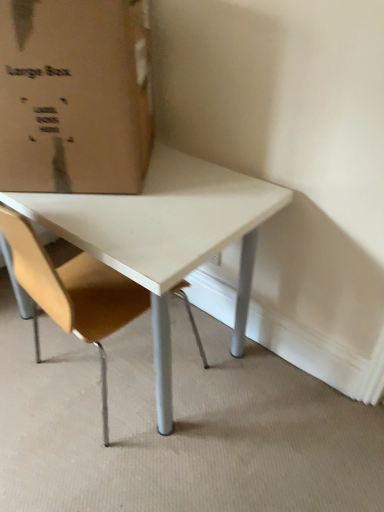
Locate an element on the screen. free space on the front side of light brown leather chair at center is located at coordinates (99, 470).